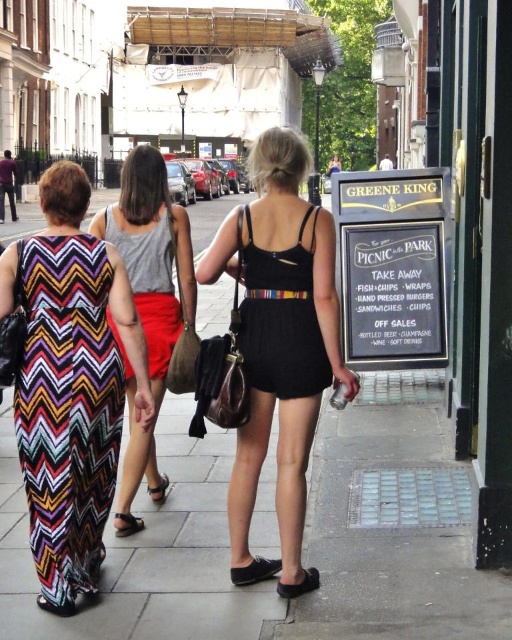
From the picture: You are a street artist planning to paint a mural on the black chalkboard sign at right and the black leather sandal at lower left. Which object requires a larger canvas to cover its entire surface?

The black chalkboard sign at right requires a larger canvas because its width is greater than the black leather sandal at lower left.

You are standing at the point marked as point (279, 333) in the image. You want to walk to the nearest building entrance which is 20 feet away from you. Can you reach it without exceeding the 20 feet limit?

The distance of point (279, 333) from viewer is 18.83 feet. Since the nearest building entrance is 20 feet away, you can reach it within the 20 feet limit.

You are a photographer standing on the street and want to take a picture of the smooth concrete pavement at center and the black textured dress at center. Which one is closer to you?

The smooth concrete pavement at center is closer to you because it is in front of the black textured dress at center.